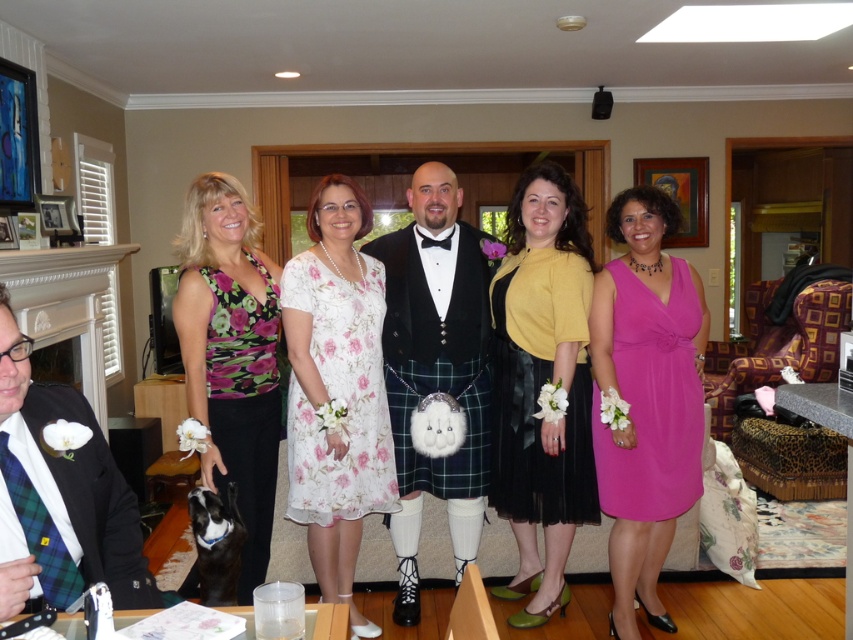
Question: Which object is closer to the camera taking this photo?

Choices:
 (A) floral chiffon dress at center
 (B) green plaid tie at left
 (C) green plaid kilt at center

Answer: (B)

Question: Among these objects, which one is nearest to the camera?

Choices:
 (A) green plaid kilt at center
 (B) yellow satin dress at center
 (C) floral chiffon dress at center

Answer: (C)

Question: Considering the real-world distances, which object is farthest from the green plaid kilt at center?

Choices:
 (A) yellow satin dress at center
 (B) floral chiffon dress at center
 (C) black velvet jacket at center
 (D) floral print dress at center

Answer: (D)

Question: Does matte black kilt at center appear on the right side of floral print dress at center?

Choices:
 (A) yes
 (B) no

Answer: (A)

Question: Is black velvet jacket at center positioned before floral chiffon dress at center?

Choices:
 (A) yes
 (B) no

Answer: (B)

Question: Does yellow satin dress at center lie behind black velvet jacket at center?

Choices:
 (A) no
 (B) yes

Answer: (A)